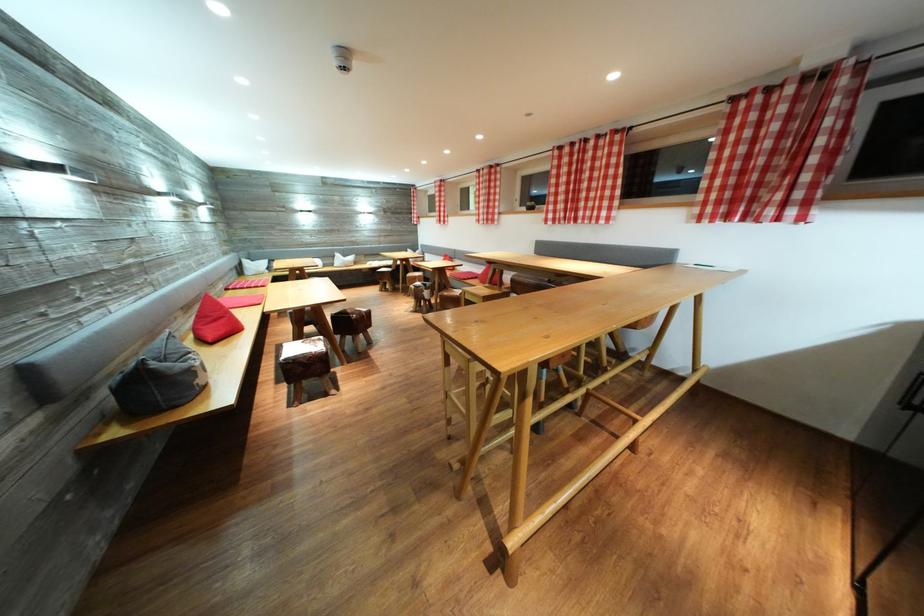
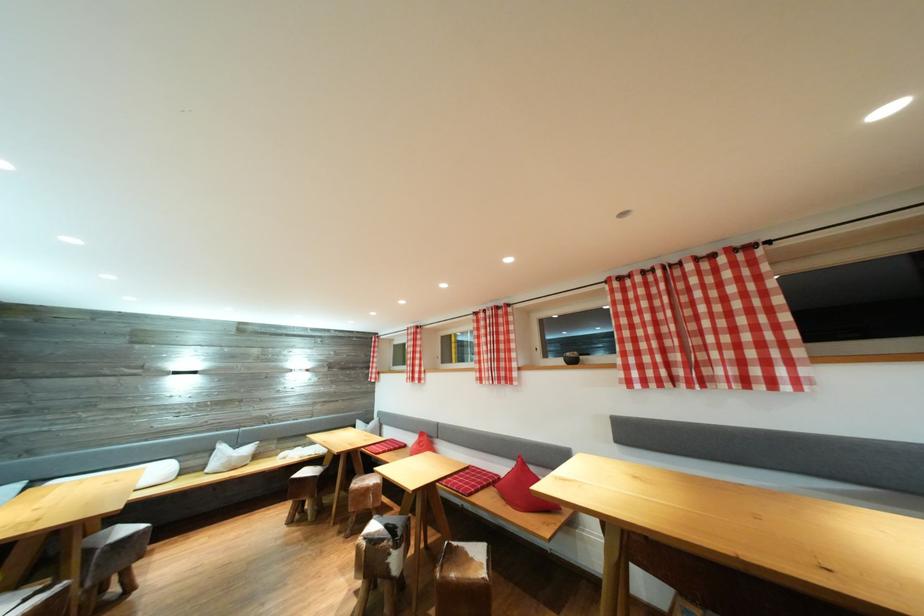
Locate, in the second image, the point that corresponds to [535,209] in the first image.

(575, 360)